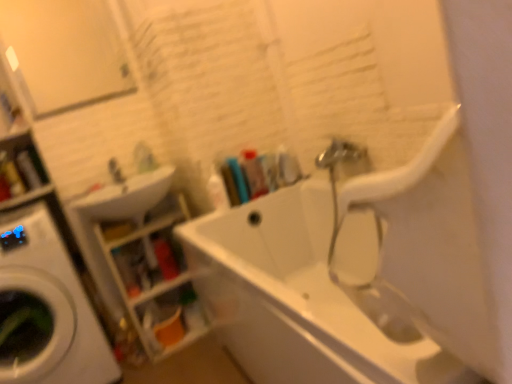
Question: Is translucent plastic bottle at center, positioned as the third toiletry in right-to-left order, facing away from white glossy sink at upper left?

Choices:
 (A) no
 (B) yes

Answer: (A)

Question: Is translucent plastic bottle at center, positioned as the third toiletry in right-to-left order, further to camera compared to white glossy sink at upper left?

Choices:
 (A) no
 (B) yes

Answer: (B)

Question: Considering the relative sizes of translucent plastic bottle at center, placed as the second toiletry when sorted from left to right, and white glossy sink at upper left in the image provided, is translucent plastic bottle at center, placed as the second toiletry when sorted from left to right, bigger than white glossy sink at upper left?

Choices:
 (A) no
 (B) yes

Answer: (A)

Question: Are translucent plastic bottle at center, positioned as the third toiletry in right-to-left order, and white glossy sink at upper left located far from each other?

Choices:
 (A) no
 (B) yes

Answer: (A)

Question: Is the depth of translucent plastic bottle at center, placed as the second toiletry when sorted from left to right, less than that of white glossy sink at upper left?

Choices:
 (A) no
 (B) yes

Answer: (A)

Question: Considering the relative sizes of translucent plastic bottle at center, placed as the second toiletry when sorted from left to right, and white glossy sink at upper left in the image provided, is translucent plastic bottle at center, placed as the second toiletry when sorted from left to right, thinner than white glossy sink at upper left?

Choices:
 (A) no
 (B) yes

Answer: (B)

Question: Is white glossy sink at upper left wider than white glossy bathtub at center?

Choices:
 (A) yes
 (B) no

Answer: (B)

Question: From the image's perspective, is white glossy sink at upper left located beneath white glossy bathtub at center?

Choices:
 (A) no
 (B) yes

Answer: (A)

Question: Is white glossy sink at upper left placed right next to white glossy bathtub at center?

Choices:
 (A) no
 (B) yes

Answer: (A)

Question: Does white glossy sink at upper left lie in front of white glossy bathtub at center?

Choices:
 (A) yes
 (B) no

Answer: (B)

Question: Is white glossy sink at upper left far away from white glossy bathtub at center?

Choices:
 (A) no
 (B) yes

Answer: (A)

Question: Is white glossy sink at upper left at the right side of white glossy bathtub at center?

Choices:
 (A) yes
 (B) no

Answer: (B)

Question: Is white glossy washing machine at left placed right next to white glossy bathtub at center?

Choices:
 (A) yes
 (B) no

Answer: (B)